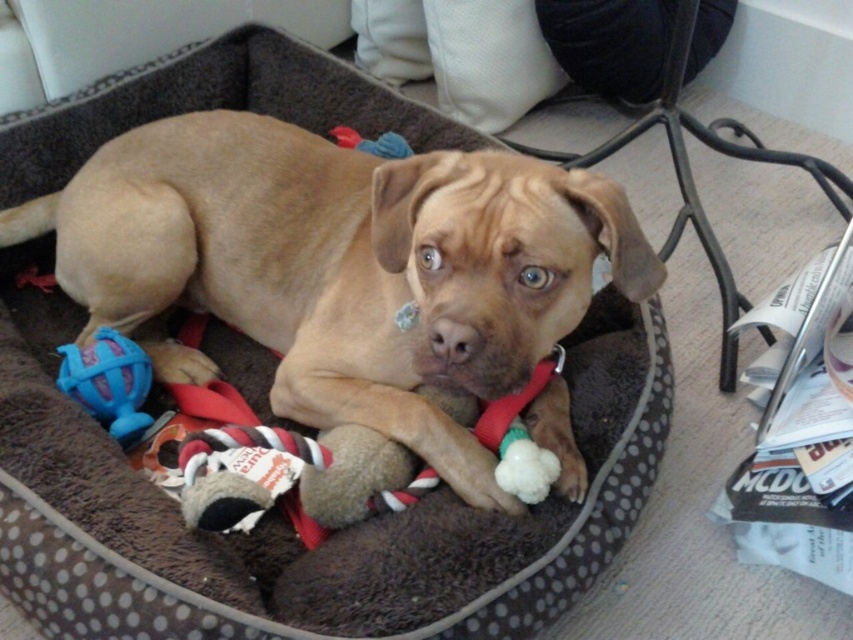
You are a drone operator trying to deliver a small package to the light brown dog in the image. The drone must fly from point A at point (297, 138) to point B at point (105, 358). According to the spatial arrangement, will the drone have a clear path from point A to point B without any obstacles?

Point (297, 138) is behind point (105, 358), so the drone will have a clear path from point A to point B as there are no obstacles blocking the flight path between them.

You are a pet owner who wants to fetch the blue rubber ball at lower left from the scene. Can you reach it without stepping over the brown fur dog at center?

The brown fur dog at center is in front of the blue rubber ball at lower left, so you would need to step over or move the dog to access the ball.

You are a pet owner who wants to place a new toy for your dog. The new toy is slightly larger than the blue rubber ball at lower left. Where should you place the new toy so it is not too close to the brown fur dog at center?

Since the brown fur dog at center is on the right side of the blue rubber ball at lower left, placing the new toy to the left of the blue rubber ball at lower left would keep it farther from the dog.